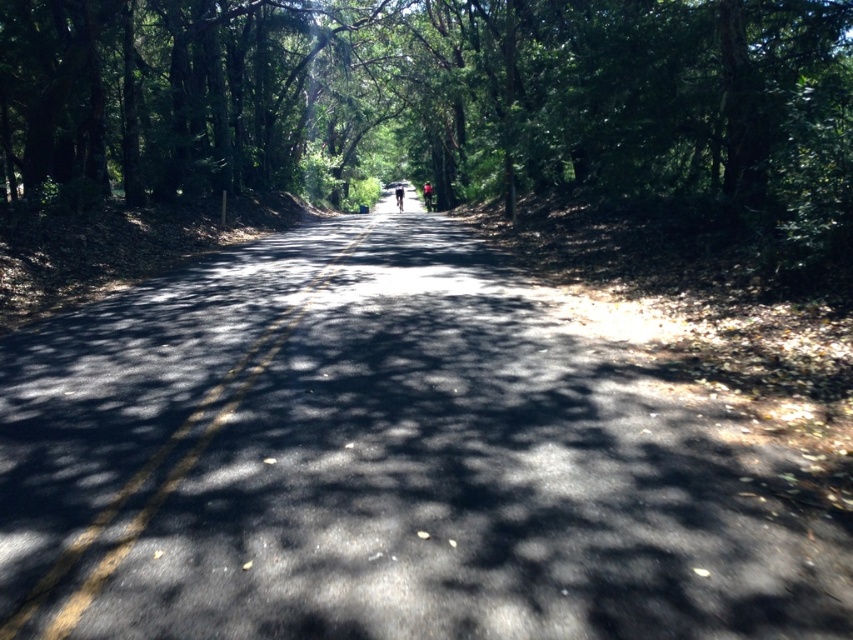
You are a pedestrian standing on the sunlit road and see the green fabric person at center and the dark blue fabric umbrella at center. Which object is wider?

The dark blue fabric umbrella at center is wider than the green fabric person at center.

You are standing on the sunlit road and see the green fabric person at center and the dark blue fabric umbrella at center. Which object is located to the right of the other?

The green fabric person at center is positioned on the right side of dark blue fabric umbrella at center.